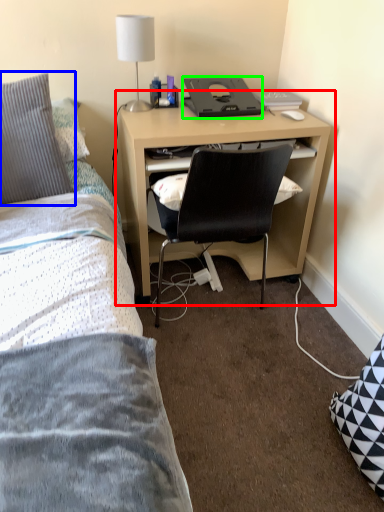
Question: Based on their relative distances, which object is farther from computer desk (highlighted by a red box)? Choose from pillow (highlighted by a blue box) and desktop (highlighted by a green box).

Choices:
 (A) pillow
 (B) desktop

Answer: (A)